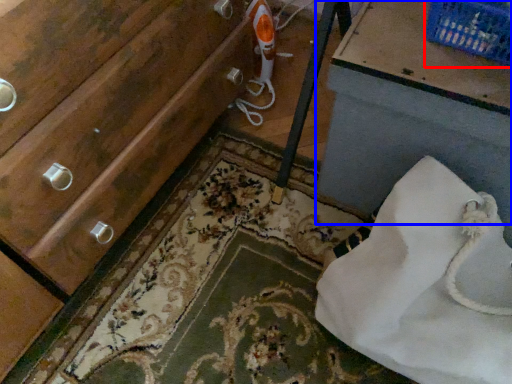
Question: Which point is closer to the camera, basket (highlighted by a red box) or vanity (highlighted by a blue box)?

Choices:
 (A) basket
 (B) vanity

Answer: (B)